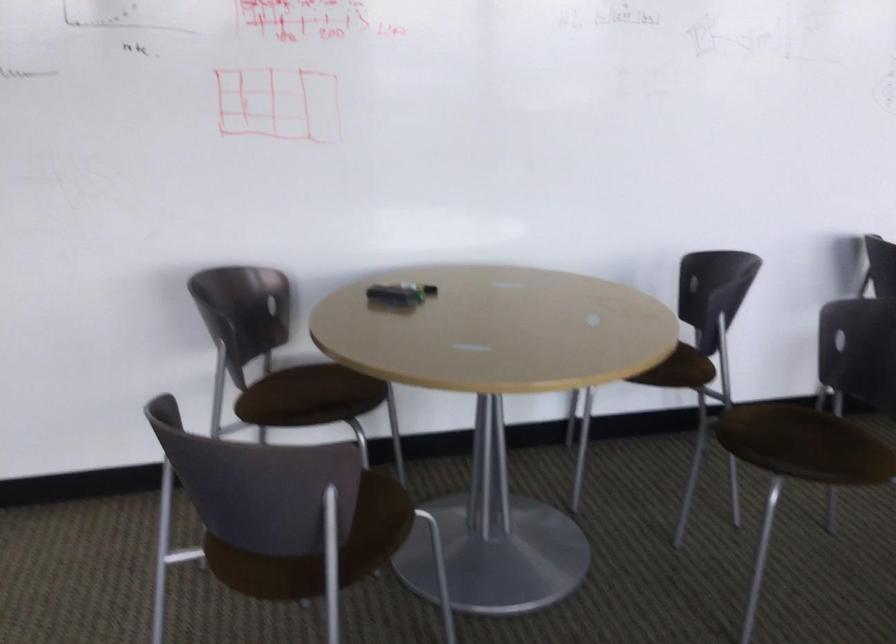
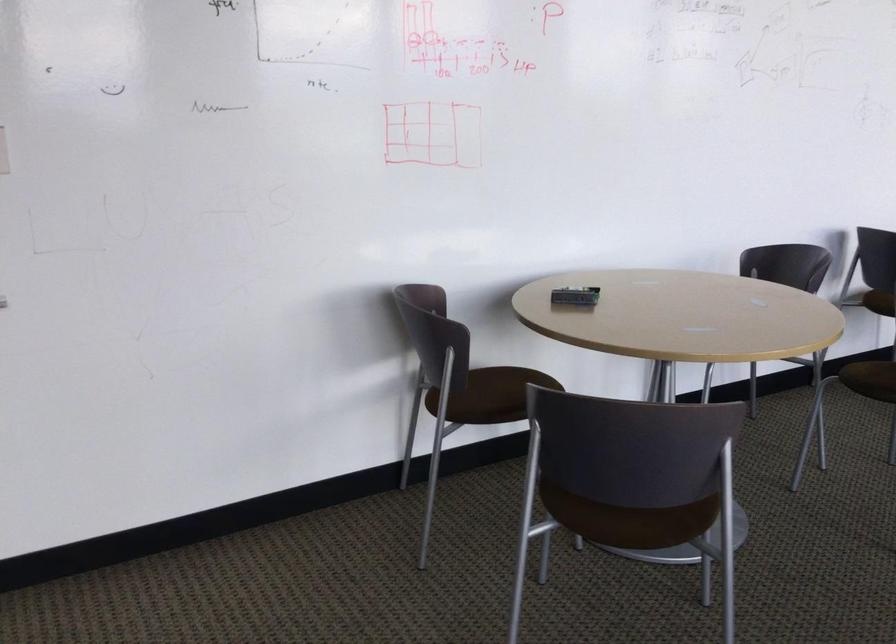
In the second image, find the point that corresponds to (389,297) in the first image.

(575, 296)